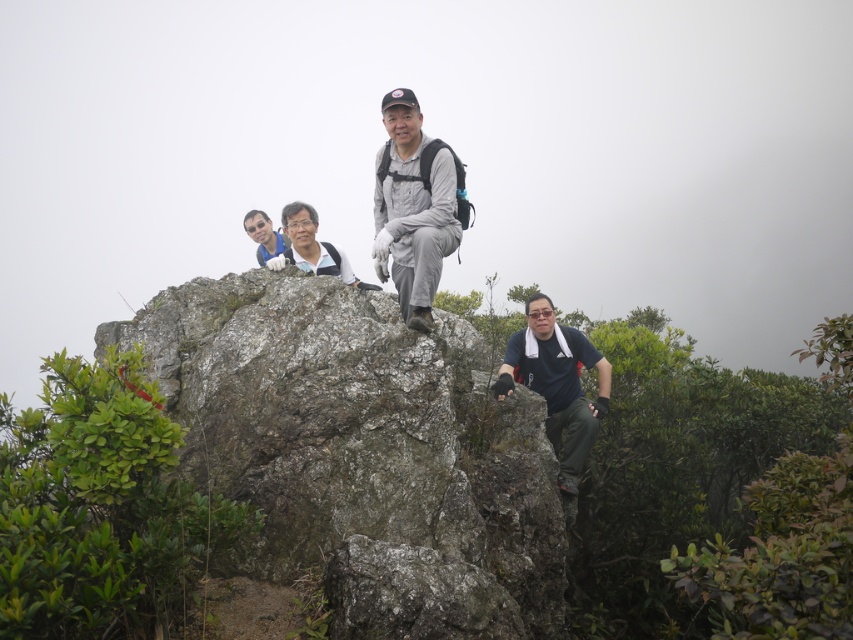
You are a hiker trying to decide where to place your gray fabric jacket at center so that it stays secure on the gray rough rock at center. Based on the scene, where should you place it?

The gray rough rock at center is positioned under the gray fabric jacket at center, so placing the jacket on the rock would keep it secure.